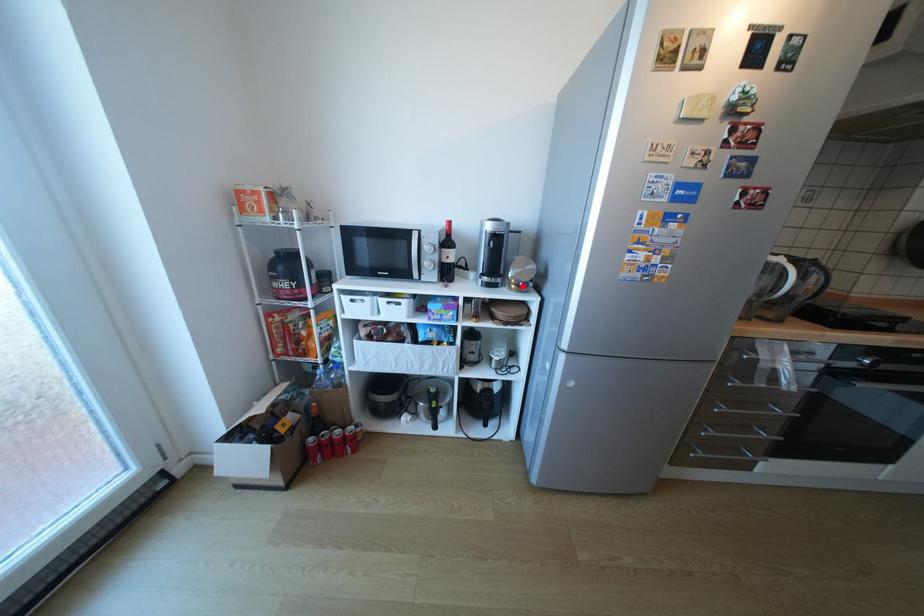
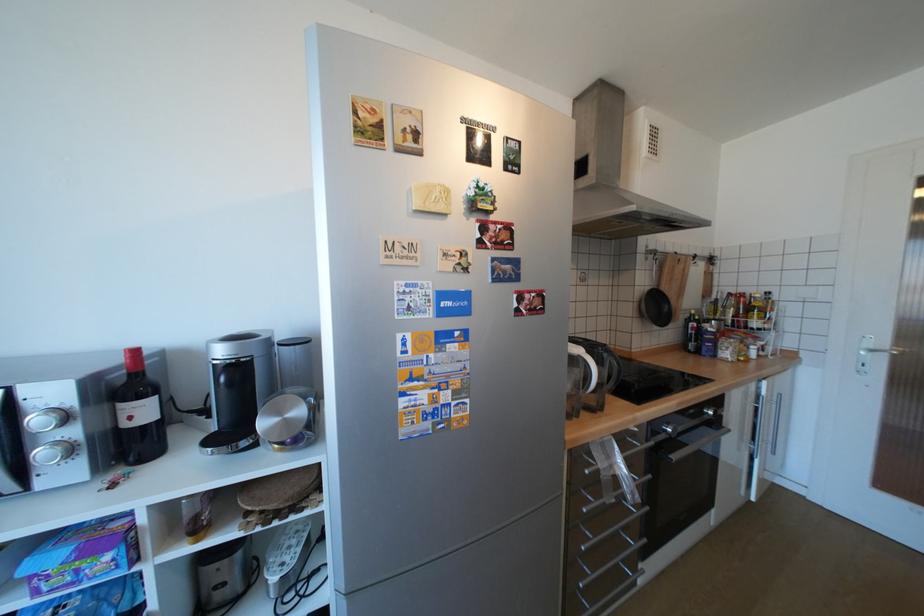
Question: A red point is marked in image1. In image2, is the corresponding 3D point closer to the camera or farther? Reply with the corresponding letter.

Choices:
 (A) The corresponding 3D point is closer.
 (B) The corresponding 3D point is farther.

Answer: (B)